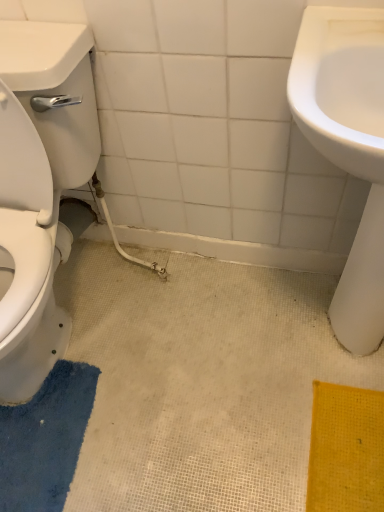
Question: From the image's perspective, is white glossy toilet at left located above or below white glossy sink at right?

Choices:
 (A) below
 (B) above

Answer: (B)

Question: Is point (11, 226) closer or farther from the camera than point (345, 166)?

Choices:
 (A) closer
 (B) farther

Answer: (B)

Question: Which is farther from the white glossy sink at right?

Choices:
 (A) white glossy toilet at left
 (B) blue textured bath mat at lower left

Answer: (B)

Question: Which is farther from the blue textured bath mat at lower left?

Choices:
 (A) white glossy toilet at left
 (B) white glossy sink at right

Answer: (B)